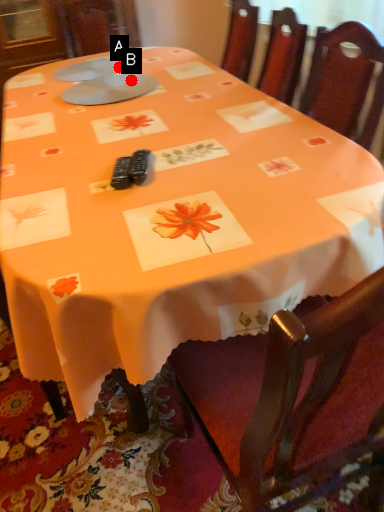
Question: Two points are circled on the image, labeled by A and B beside each circle. Which point is closer to the camera taking this photo?

Choices:
 (A) A is closer
 (B) B is closer

Answer: (B)